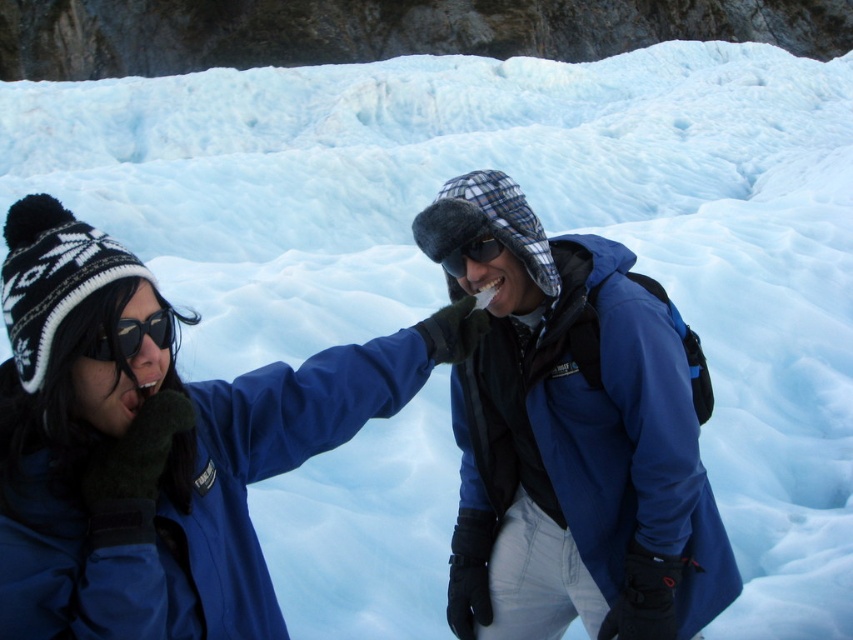
Question: Is matte black goggles at left further to the viewer compared to black matte goggles at center?

Choices:
 (A) yes
 (B) no

Answer: (B)

Question: Which point appears closest to the camera in this image?

Choices:
 (A) (30, 422)
 (B) (126, 342)

Answer: (A)

Question: Estimate the real-world distances between objects in this image. Which object is farther from the black matte goggles at center?

Choices:
 (A) blue fleece jacket at center
 (B) matte blue jacket at center

Answer: (A)

Question: Is matte black goggles at left closer to the viewer compared to black matte goggles at center?

Choices:
 (A) no
 (B) yes

Answer: (B)

Question: Does matte blue jacket at center have a lesser width compared to matte black goggles at left?

Choices:
 (A) no
 (B) yes

Answer: (B)

Question: Which point is farther to the camera?

Choices:
 (A) black matte goggles at center
 (B) matte blue jacket at center
 (C) matte black goggles at left
 (D) blue fleece jacket at center

Answer: (D)